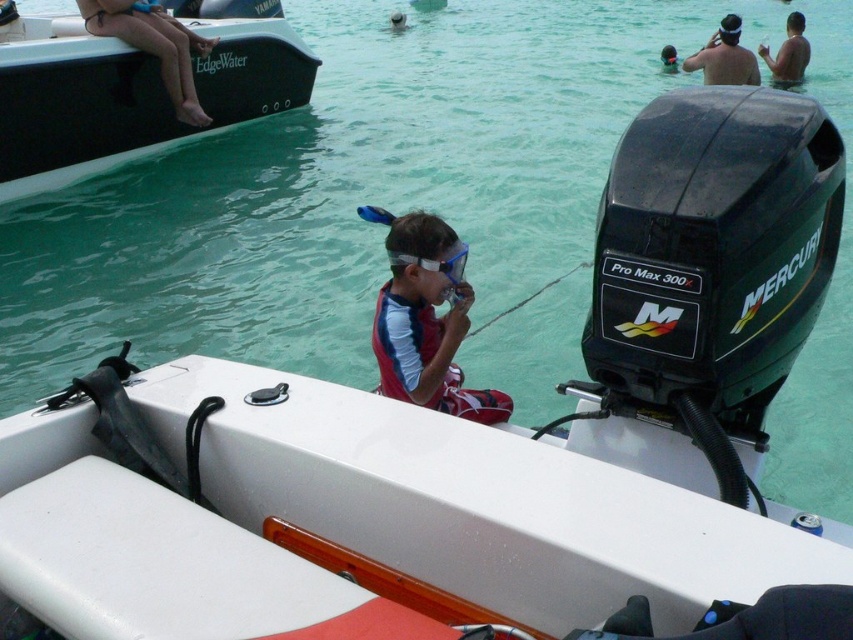
Is red matte snorkel gear at center above tan skin legs at upper left?

No.

Is red matte snorkel gear at center positioned at the back of tan skin legs at upper left?

No, it is in front of tan skin legs at upper left.

Does point (398, 298) lie behind point (117, 12)?

No, (398, 298) is closer to viewer.

At what (x,y) coordinates should I click in order to perform the action: click on red matte snorkel gear at center. Please return your answer as a coordinate pair (x, y). The width and height of the screenshot is (853, 640). Looking at the image, I should click on (428, 323).

Does point (125, 4) come closer to viewer compared to point (396, 264)?

No, (125, 4) is behind (396, 264).

Is tan skin legs at upper left shorter than clear plastic goggles at center?

Incorrect, tan skin legs at upper left's height does not fall short of clear plastic goggles at center's.

Between point (167, 32) and point (454, 269), which one is positioned in front?

Point (454, 269)

Where is `tan skin legs at upper left`? tan skin legs at upper left is located at coordinates 154,45.

Does red matte life jacket at center come in front of skinny man at upper right?

Yes, red matte life jacket at center is in front of skinny man at upper right.

Is point (412, 317) in front of point (791, 49)?

Yes, point (412, 317) is closer to viewer.

Does point (386, 284) lie in front of point (779, 68)?

Yes, point (386, 284) is closer to viewer.

Identify the location of red matte life jacket at center. (415, 346).